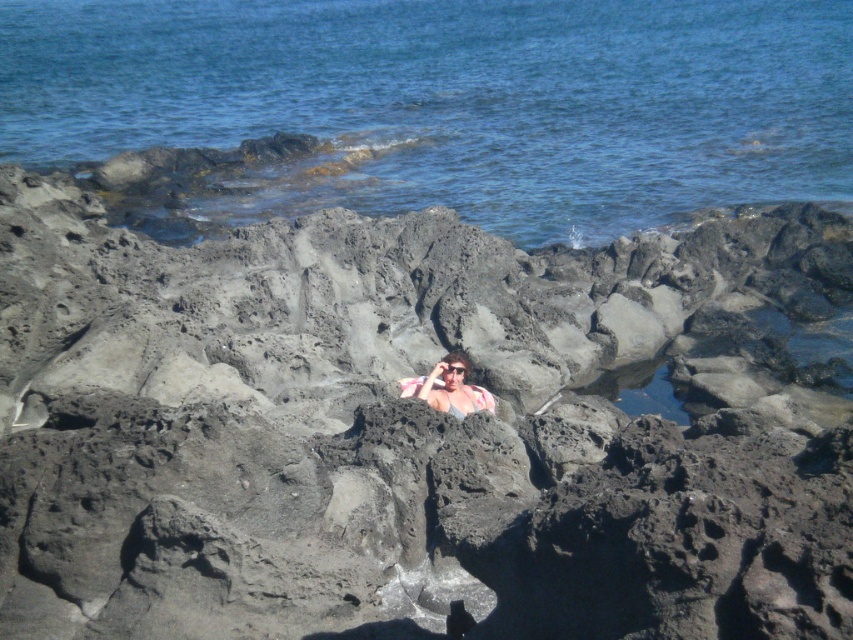
You are navigating a drone over a rocky shoreline and need to drop a package near the black rough rock at center. According to the coordinates provided, where should you aim the drop?

The black rough rock at center is located at point [412,428], so you should aim the drone drop at those coordinates to place the package near the black rough rock at center.

You are a geologist examining the rocky shoreline. You need to locate the black rough rock at center. According to the coordinates provided, where would you find it?

You can find the black rough rock at center at point [412,428].